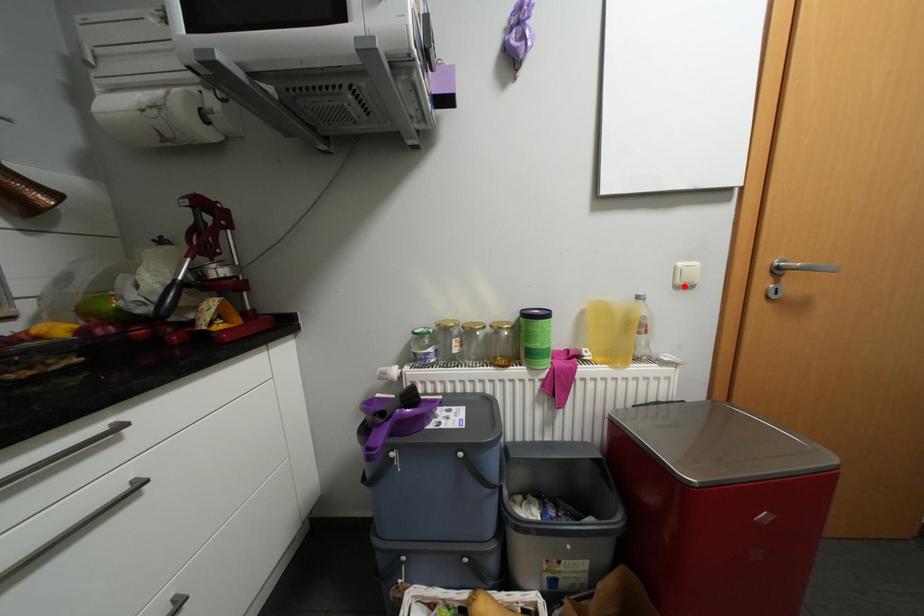
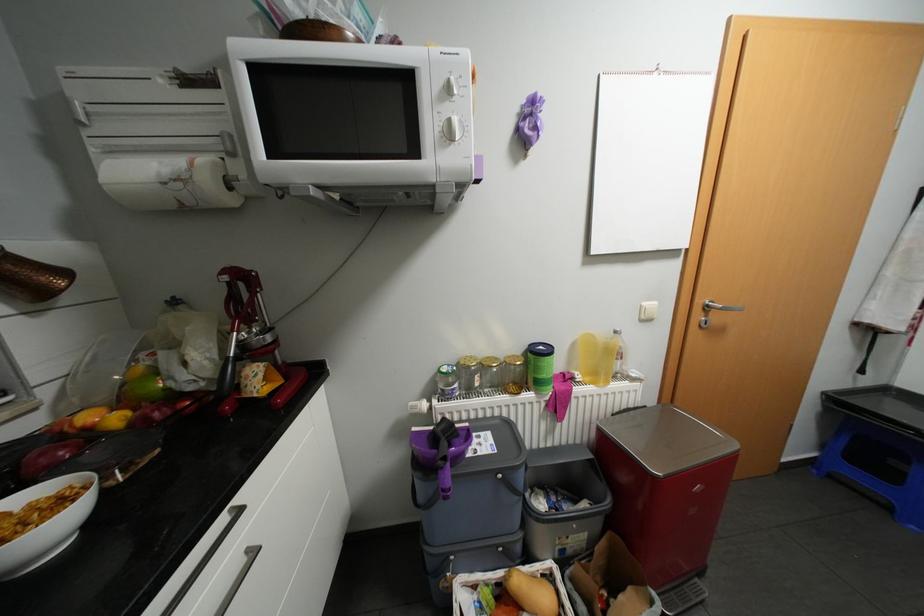
In the second image, find the point that corresponds to the highlighted location in the first image.

(649, 320)